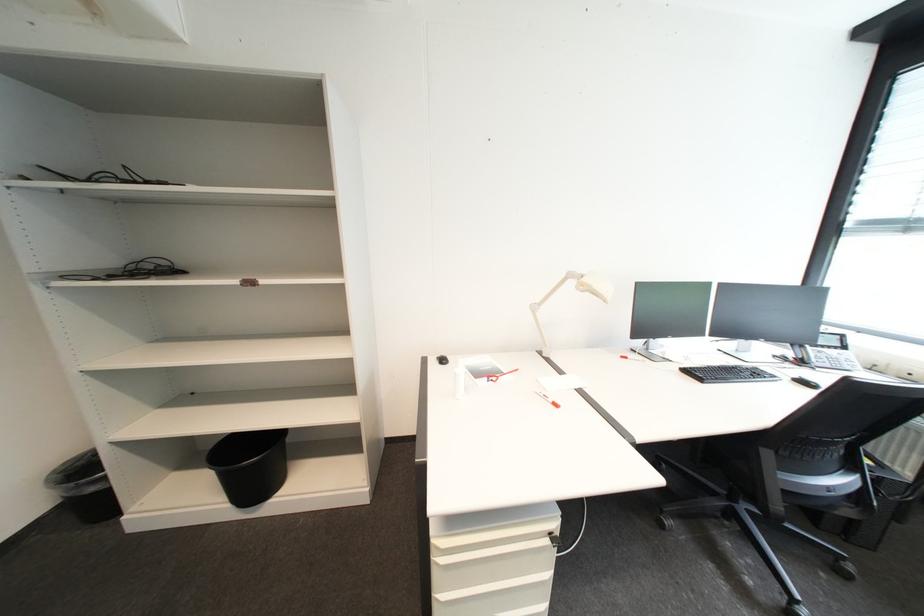
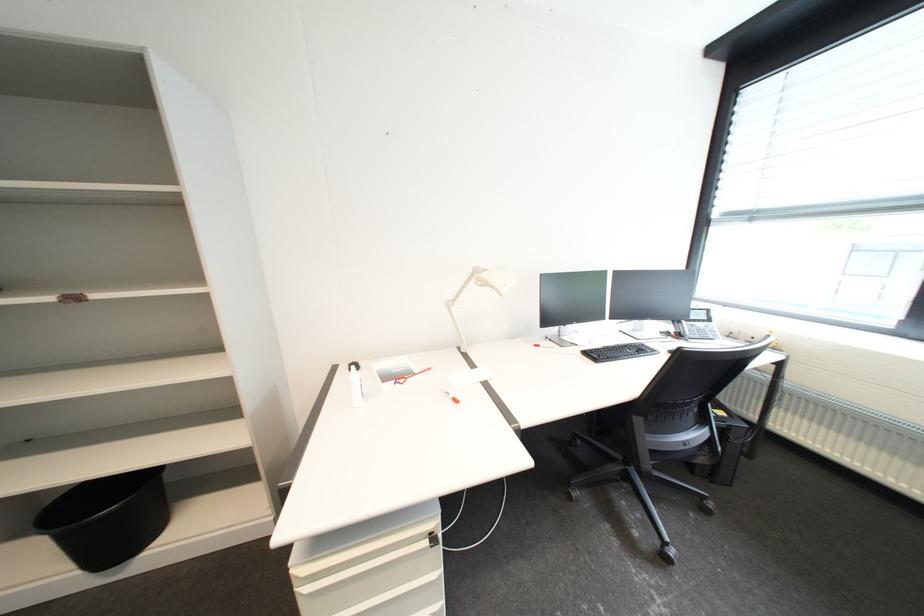
Question: The images are taken continuously from a first-person perspective. In which direction is your viewpoint rotating?

Choices:
 (A) Left
 (B) Right
 (C) Up
 (D) Down

Answer: (B)